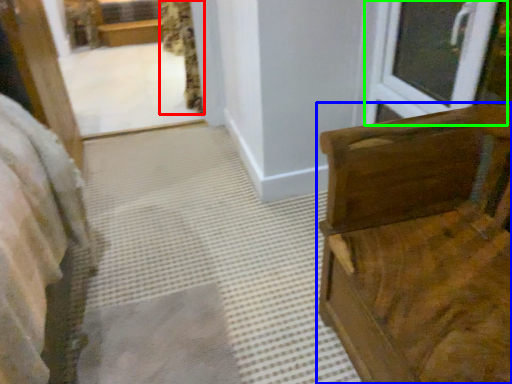
Question: Considering the real-world distances, which object is farthest from curtain (highlighted by a red box)? furniture (highlighted by a blue box) or window (highlighted by a green box)?

Choices:
 (A) furniture
 (B) window

Answer: (A)